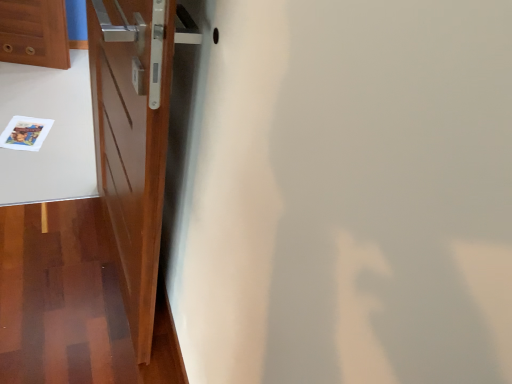
The height and width of the screenshot is (384, 512). What do you see at coordinates (132, 139) in the screenshot?
I see `glossy wood door at left` at bounding box center [132, 139].

Where is `glossy wood door at left`? glossy wood door at left is located at coordinates (132, 139).

At what (x,y) coordinates should I click in order to perform the action: click on glossy wood door at left. Please return your answer as a coordinate pair (x, y). Looking at the image, I should click on (132, 139).